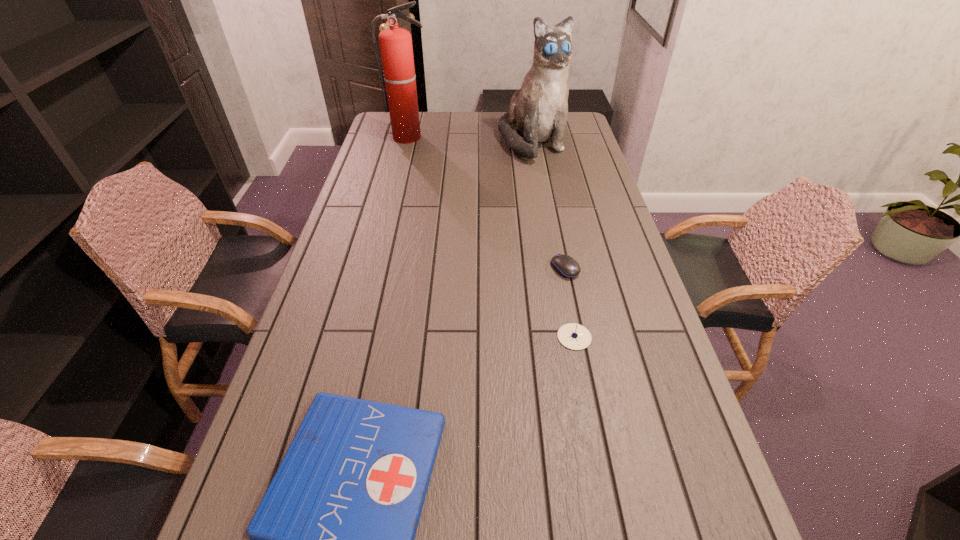
At what (x,y) coordinates should I click in order to perform the action: click on empty space between the cat and the third tallest object. Please return your answer as a coordinate pair (x, y). Looking at the image, I should click on (553, 239).

Where is `free space between the fourth farthest object and the third nearest object`? The image size is (960, 540). free space between the fourth farthest object and the third nearest object is located at coordinates (569, 302).

Where is `free space that is in between the third tallest object and the computer mouse`? Image resolution: width=960 pixels, height=540 pixels. free space that is in between the third tallest object and the computer mouse is located at coordinates (569, 302).

Locate an element on the screen. The image size is (960, 540). object that is the second closest to the compass is located at coordinates (332, 539).

Select which object appears as the third closest to the cat. Please provide its 2D coordinates. Your answer should be formatted as a tuple, i.e. [(x, y)], where the tuple contains the x and y coordinates of a point satisfying the conditions above.

[(573, 336)]

Locate an element on the screen. The image size is (960, 540). vacant space that satisfies the following two spatial constraints: 1. on the back side of the computer mouse; 2. on the right side of the fourth farthest object is located at coordinates (561, 268).

I want to click on vacant point that satisfies the following two spatial constraints: 1. with the nozzle and gauge on the third farthest object; 2. on the right side of the fire extinguisher, so click(376, 268).

Locate an element on the screen. This screenshot has width=960, height=540. vacant area that satisfies the following two spatial constraints: 1. at the face of the computer mouse; 2. on the left side of the cat is located at coordinates (555, 268).

Identify the location of free space that satisfies the following two spatial constraints: 1. with the nozzle and gauge on the fire extinguisher; 2. on the right side of the compass. (359, 337).